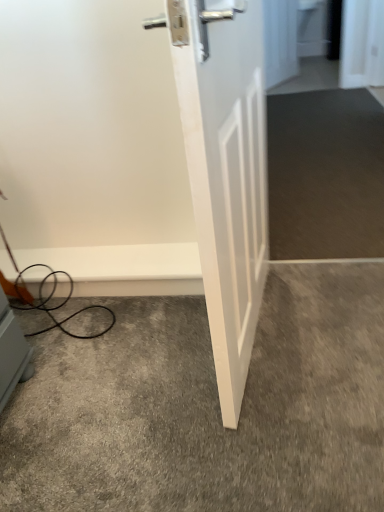
Describe the element at coordinates (208, 407) in the screenshot. The width and height of the screenshot is (384, 512). I see `gray carpet at lower center` at that location.

Measure the distance between gray carpet at lower center and camera.

A distance of 37.01 inches exists between gray carpet at lower center and camera.

The height and width of the screenshot is (512, 384). Identify the location of gray carpet at lower center. (208, 407).

The image size is (384, 512). Identify the location of white matte door at center. (225, 170).

The width and height of the screenshot is (384, 512). What do you see at coordinates (225, 170) in the screenshot? I see `white matte door at center` at bounding box center [225, 170].

Locate an element on the screen. The width and height of the screenshot is (384, 512). gray carpet at lower center is located at coordinates (208, 407).

Visually, is white matte door at center positioned to the left or to the right of gray carpet at lower center?

In the image, white matte door at center appears on the right side of gray carpet at lower center.

Is white matte door at center positioned in front of gray carpet at lower center?

That is True.

Between point (192, 60) and point (23, 460), which one is positioned behind?

The point (23, 460) is more distant.

From the image's perspective, is white matte door at center below gray carpet at lower center?

Actually, white matte door at center appears above gray carpet at lower center in the image.

From a real-world perspective, is white matte door at center below gray carpet at lower center?

No, from a real-world perspective, white matte door at center is not below gray carpet at lower center.

Considering the relative sizes of white matte door at center and gray carpet at lower center in the image provided, is white matte door at center wider than gray carpet at lower center?

Incorrect, the width of white matte door at center does not surpass that of gray carpet at lower center.

In terms of height, does white matte door at center look taller or shorter compared to gray carpet at lower center?

In the image, white matte door at center appears to be taller than gray carpet at lower center.

Who is bigger, white matte door at center or gray carpet at lower center?

white matte door at center is bigger.

Is gray carpet at lower center completely or partially inside white matte door at center?

No, gray carpet at lower center is located outside of white matte door at center.

Are white matte door at center and gray carpet at lower center located far from each other?

No, white matte door at center is in close proximity to gray carpet at lower center.

From the picture: Is white matte door at center positioned with its back to gray carpet at lower center?

Yes, white matte door at center is positioned with its back facing gray carpet at lower center.

What are the coordinates of `door that appears above the gray carpet at lower center (from a real-world perspective)` in the screenshot? It's located at pyautogui.click(x=225, y=170).

Is gray carpet at lower center at the right side of white matte door at center?

In fact, gray carpet at lower center is to the left of white matte door at center.

Which object is closer to the camera, gray carpet at lower center or white matte door at center?

white matte door at center is closer to the camera.

Considering the points (178, 455) and (217, 348), which point is in front, point (178, 455) or point (217, 348)?

The point (217, 348) is more forward.

From the image's perspective, would you say gray carpet at lower center is positioned over white matte door at center?

No, from the image's perspective, gray carpet at lower center is not over white matte door at center.

From a real-world perspective, which is physically below, gray carpet at lower center or white matte door at center?

gray carpet at lower center is physically lower.

Which object is thinner, gray carpet at lower center or white matte door at center?

Thinner between the two is white matte door at center.

Who is taller, gray carpet at lower center or white matte door at center?

With more height is white matte door at center.

Is gray carpet at lower center bigger than white matte door at center?

No.

Can we say gray carpet at lower center lies outside white matte door at center?

Absolutely, gray carpet at lower center is external to white matte door at center.

Is gray carpet at lower center next to white matte door at center?

gray carpet at lower center is not next to white matte door at center, and they're not touching.

Could you tell me if gray carpet at lower center is facing white matte door at center?

No, gray carpet at lower center is not aimed at white matte door at center.

How many degrees apart are the facing directions of gray carpet at lower center and white matte door at center?

They differ by 100 degrees in their facing directions.

Locate an element on the screen. This screenshot has height=512, width=384. concrete to the left of white matte door at center is located at coordinates (208, 407).

The image size is (384, 512). Find the location of `concrete that appears on the left of white matte door at center`. concrete that appears on the left of white matte door at center is located at coordinates (208, 407).

At what (x,y) coordinates should I click in order to perform the action: click on concrete below the white matte door at center (from the image's perspective). Please return your answer as a coordinate pair (x, y). Looking at the image, I should click on (208, 407).